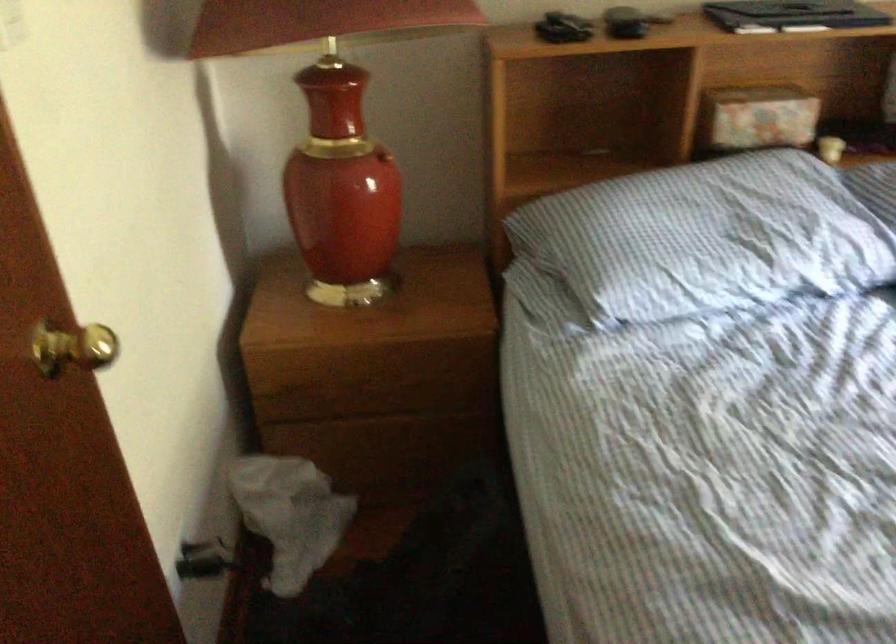
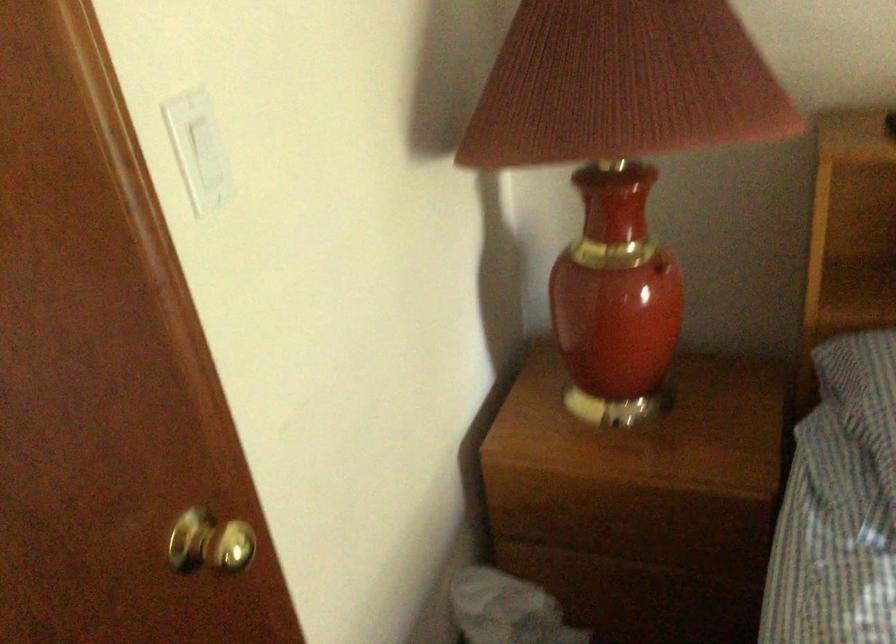
Find the pixel in the second image that matches [382,153] in the first image.

(661, 267)